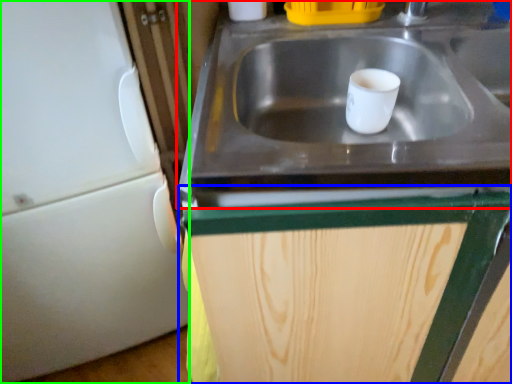
Question: Based on their relative distances, which object is nearer to sink (highlighted by a red box)? Choose from cabinetry (highlighted by a blue box) and appliance (highlighted by a green box).

Choices:
 (A) cabinetry
 (B) appliance

Answer: (A)